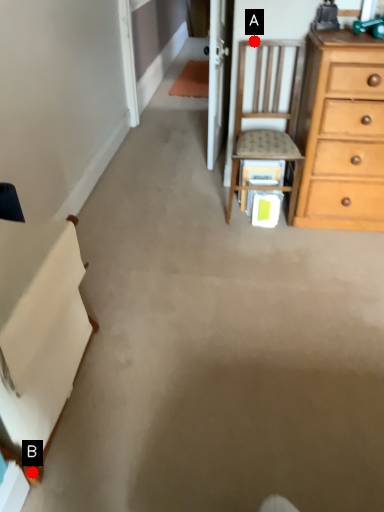
Question: Two points are circled on the image, labeled by A and B beside each circle. Which point is closer to the camera?

Choices:
 (A) A is closer
 (B) B is closer

Answer: (B)